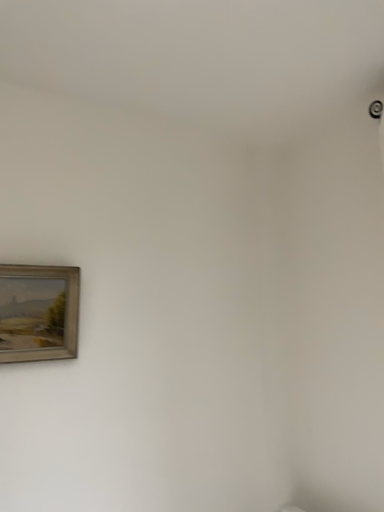
Question: Should I look upward or downward to see wooden-framed painting at lower left?

Choices:
 (A) up
 (B) down

Answer: (B)